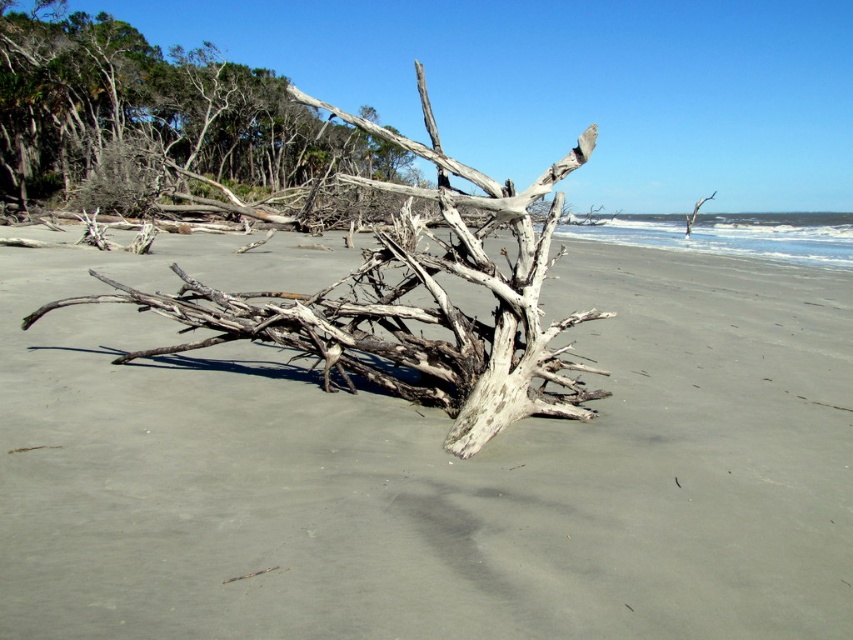
Question: Can you confirm if gray sand at center is smaller than gray bark tree at upper left?

Choices:
 (A) yes
 (B) no

Answer: (A)

Question: Which object appears closest to the camera in this image?

Choices:
 (A) gray sand at center
 (B) gray bark tree at upper left

Answer: (A)

Question: Which point appears farthest from the camera in this image?

Choices:
 (A) (206, 131)
 (B) (668, 531)

Answer: (A)

Question: Does gray sand at center have a lesser width compared to gray bark tree at upper left?

Choices:
 (A) no
 (B) yes

Answer: (B)

Question: Can you confirm if gray sand at center is positioned to the left of gray bark tree at upper left?

Choices:
 (A) yes
 (B) no

Answer: (B)

Question: Which point is farther to the camera?

Choices:
 (A) gray bark tree at upper left
 (B) gray sand at center

Answer: (A)